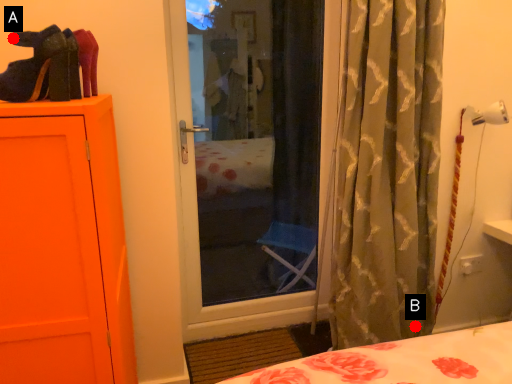
Question: Two points are circled on the image, labeled by A and B beside each circle. Which point is closer to the camera?

Choices:
 (A) A is closer
 (B) B is closer

Answer: (A)